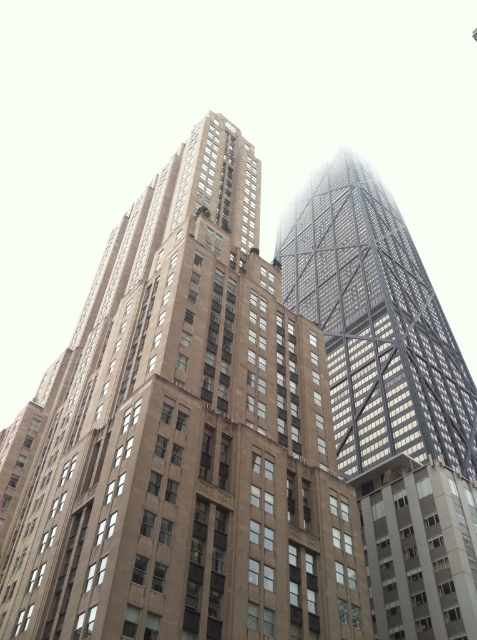
You are standing at the origin point of the coordinate system in the image. The brown stone building at center is located at a specific coordinate. Can you determine its exact coordinates?

The brown stone building at center is located at coordinates point (183, 438).

You are standing in a plaza in front of the brown stone building at center. You want to take a photo of the building with your smartphone. The recommended distance for clear photos is at least 30 meters. Is the current distance sufficient?

The brown stone building at center and viewer are 31.60 meters apart from each other. Since the recommended distance is at least 30 meters, the current distance of 31.60 meters is sufficient for a clear photo.